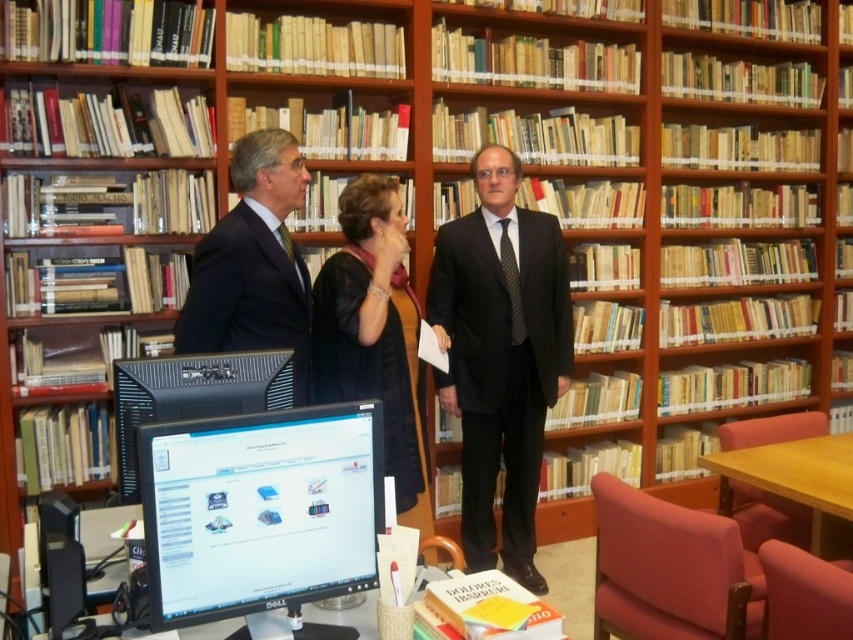
Who is more forward, (386, 387) or (242, 276)?

Point (242, 276)

Between black silk dress at center and matte black suit at center, which one has more height?

black silk dress at center is taller.

What are the coordinates of `black silk dress at center` in the screenshot? It's located at tap(372, 330).

The height and width of the screenshot is (640, 853). I want to click on black silk dress at center, so click(x=372, y=330).

Based on the photo, between matte black monitor at center and black suit at center, which one is positioned higher?

Positioned higher is black suit at center.

Is matte black monitor at center to the right of black suit at center from the viewer's perspective?

Indeed, matte black monitor at center is positioned on the right side of black suit at center.

You are a GUI agent. You are given a task and a screenshot of the screen. Output one action in this format:
    pyautogui.click(x=<x>, y=<y>)
    Task: Click on the matte black monitor at center
    This screenshot has width=853, height=640.
    Given the screenshot: What is the action you would take?
    pyautogui.click(x=260, y=509)

Where is `matte black monitor at center`? Image resolution: width=853 pixels, height=640 pixels. matte black monitor at center is located at coordinates tap(260, 509).

Which is more to the left, black suit at center or black plastic monitor at center?

From the viewer's perspective, black plastic monitor at center appears more on the left side.

What do you see at coordinates (364, 317) in the screenshot? This screenshot has height=640, width=853. I see `black suit at center` at bounding box center [364, 317].

This screenshot has height=640, width=853. In order to click on black suit at center in this screenshot , I will do `click(364, 317)`.